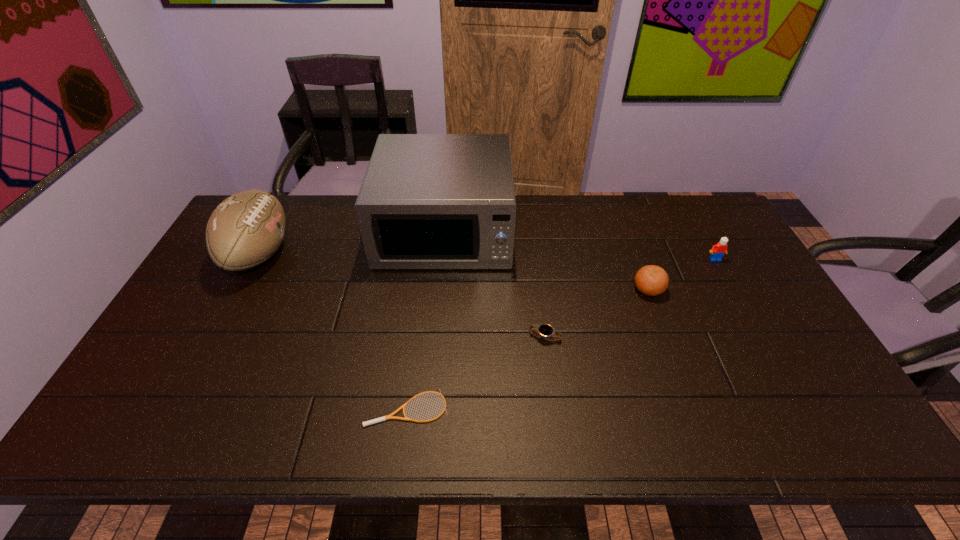
At what (x,y) coordinates should I click in order to perform the action: click on object at the right edge. Please return your answer as a coordinate pair (x, y). The height and width of the screenshot is (540, 960). Looking at the image, I should click on [x=718, y=250].

Image resolution: width=960 pixels, height=540 pixels. What are the coordinates of `object that is at the far left corner` in the screenshot? It's located at (246, 229).

I want to click on vacant space at the far edge of the desktop, so click(335, 226).

In order to click on vacant space at the near edge in this screenshot , I will do `click(683, 433)`.

The width and height of the screenshot is (960, 540). I want to click on free space at the left edge of the desktop, so click(152, 363).

The image size is (960, 540). What are the coordinates of `vacant space at the right edge of the desktop` in the screenshot? It's located at (690, 240).

Find the location of a particular element. This screenshot has width=960, height=540. vacant region at the far right corner of the desktop is located at coordinates (x=691, y=229).

The height and width of the screenshot is (540, 960). In order to click on free spot between the football (American) and the third shortest object in this screenshot , I will do `click(454, 272)`.

In order to click on free space between the tennis racket and the tallest object in this screenshot , I will do `click(425, 320)`.

In order to click on vacant space that is in between the tennis racket and the Lego in this screenshot , I will do `click(561, 334)`.